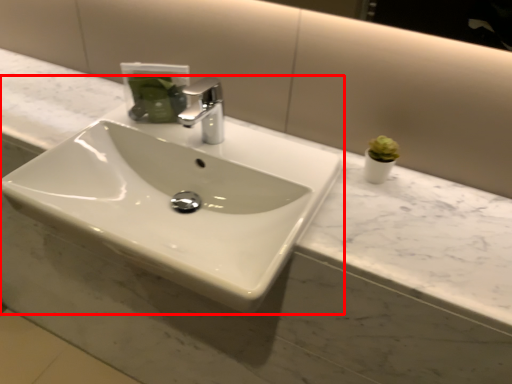
Question: From the image's perspective, what is the correct spatial relationship of sink (annotated by the red box) in relation to tap?

Choices:
 (A) below
 (B) above

Answer: (A)